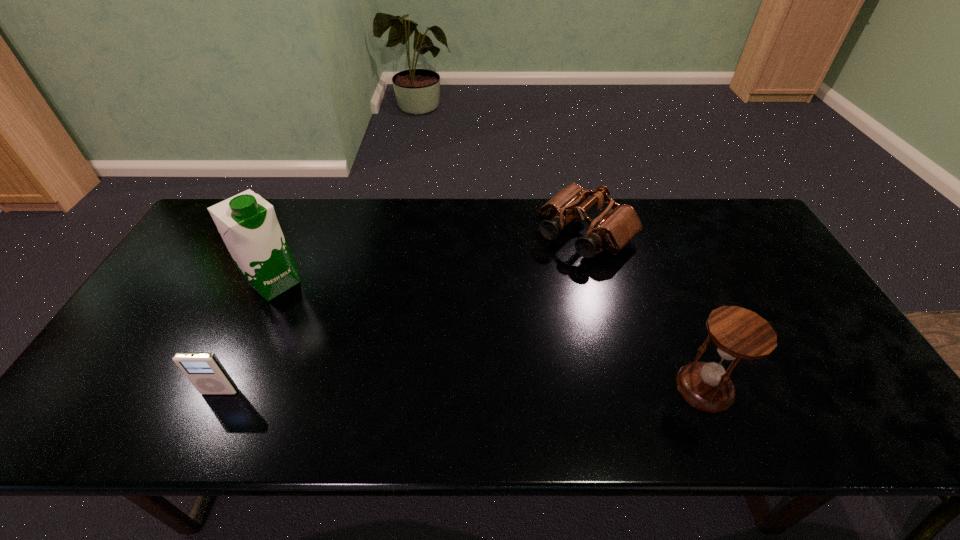
The height and width of the screenshot is (540, 960). In order to click on vacant area situated on the front-facing side of the tallest object in this screenshot , I will do `click(311, 314)`.

Locate an element on the screen. object situated at the far edge is located at coordinates [x=615, y=227].

Image resolution: width=960 pixels, height=540 pixels. What are the coordinates of `iPod located in the near edge section of the desktop` in the screenshot? It's located at (204, 370).

Find the location of a particular element. The width and height of the screenshot is (960, 540). hourglass located in the near edge section of the desktop is located at coordinates (738, 333).

Locate an element on the screen. vacant space at the far edge of the desktop is located at coordinates (492, 204).

Locate an element on the screen. This screenshot has width=960, height=540. vacant space at the near edge of the desktop is located at coordinates (636, 366).

At what (x,y) coordinates should I click in order to perform the action: click on vacant position at the left edge of the desktop. Please return your answer as a coordinate pair (x, y). Looking at the image, I should click on (132, 352).

The width and height of the screenshot is (960, 540). In the image, there is a desktop. What are the coordinates of `free region at the right edge` in the screenshot? It's located at (748, 275).

This screenshot has width=960, height=540. Find the location of `free space that is in between the tallest object and the iPod`. free space that is in between the tallest object and the iPod is located at coordinates (x=248, y=338).

Where is `free space that is in between the second tallest object and the iPod`? free space that is in between the second tallest object and the iPod is located at coordinates (462, 390).